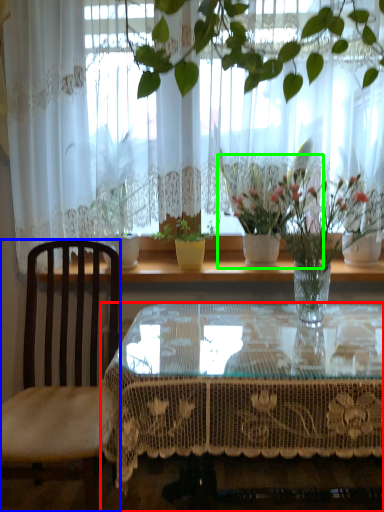
Question: Which is farther away from coffee table (highlighted by a red box)? chair (highlighted by a blue box) or houseplant (highlighted by a green box)?

Choices:
 (A) chair
 (B) houseplant

Answer: (B)